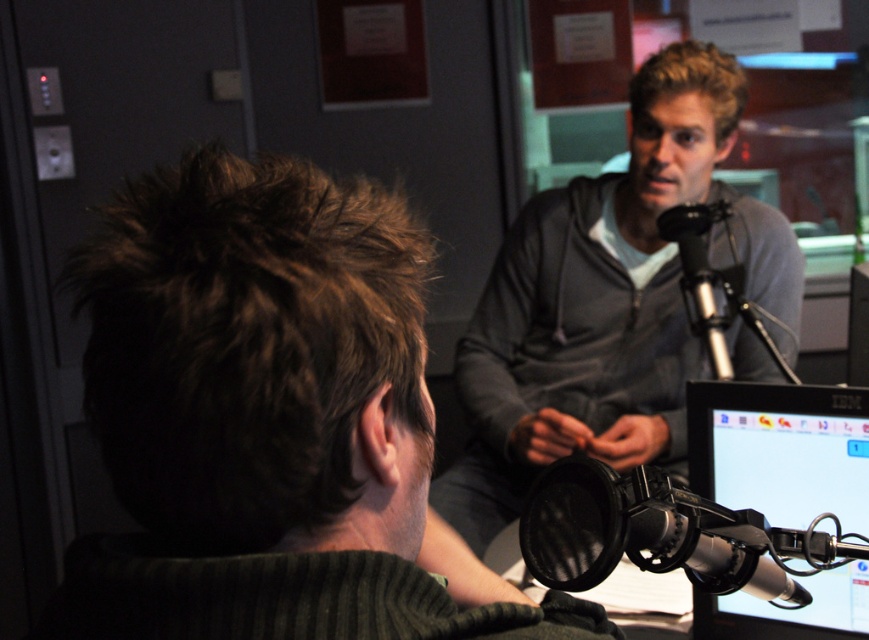
You are setting up a camera to capture the recording session. The camera is placed at the back of the room, aligned with the person facing the microphone. To ensure the black glossy monitor at lower right is visible in the shot, where should you position the camera relative to the microphone?

The black glossy monitor at lower right is located at point (780, 449), so positioning the camera to the right and slightly below the microphone would ensure the monitor is visible in the shot.

You are setting up a small recording booth and need to place the black glossy monitor at lower right and the black metallic microphone at center. Given their sizes, which object should you place first to ensure they both fit?

The black glossy monitor at lower right occupies less space than the black metallic microphone at center, so you should place the black metallic microphone at center first to accommodate its larger size before fitting the smaller monitor.